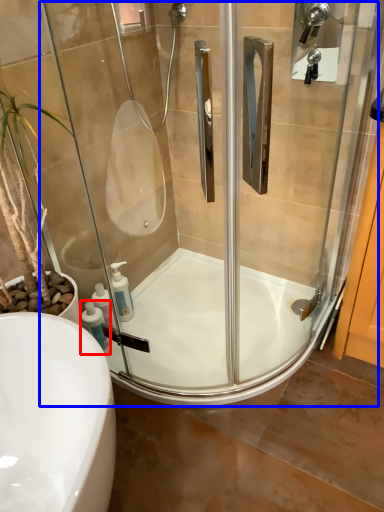
Question: Among these objects, which one is farthest to the camera, soap dispenser (highlighted by a red box) or screen door (highlighted by a blue box)?

Choices:
 (A) soap dispenser
 (B) screen door

Answer: (A)